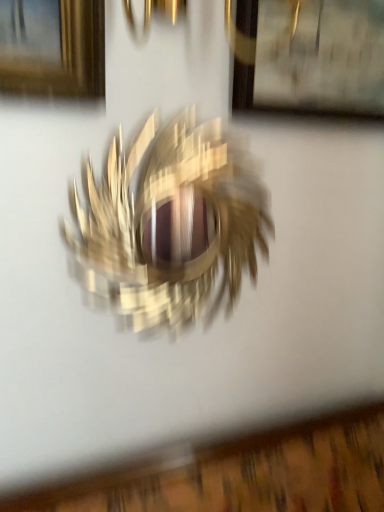
Question: Is wooden picture frame at upper center behind metallic gold bird at center?

Choices:
 (A) yes
 (B) no

Answer: (A)

Question: Does wooden picture frame at upper center have a smaller size compared to metallic gold bird at center?

Choices:
 (A) no
 (B) yes

Answer: (B)

Question: Can you confirm if wooden picture frame at upper center is positioned to the right of metallic gold bird at center?

Choices:
 (A) yes
 (B) no

Answer: (A)

Question: From a real-world perspective, is wooden picture frame at upper center physically below metallic gold bird at center?

Choices:
 (A) yes
 (B) no

Answer: (B)

Question: Can you confirm if wooden picture frame at upper center is taller than metallic gold bird at center?

Choices:
 (A) yes
 (B) no

Answer: (B)

Question: Can you confirm if wooden picture frame at upper center is wider than metallic gold bird at center?

Choices:
 (A) yes
 (B) no

Answer: (A)

Question: From a real-world perspective, is metallic gold bird at center positioned over wooden picture frame at upper center based on gravity?

Choices:
 (A) yes
 (B) no

Answer: (B)

Question: Does metallic gold bird at center lie in front of wooden picture frame at upper center?

Choices:
 (A) yes
 (B) no

Answer: (A)

Question: Considering the relative sizes of metallic gold bird at center and wooden picture frame at upper center in the image provided, is metallic gold bird at center bigger than wooden picture frame at upper center?

Choices:
 (A) yes
 (B) no

Answer: (A)

Question: Does metallic gold bird at center have a greater width compared to wooden picture frame at upper center?

Choices:
 (A) no
 (B) yes

Answer: (A)

Question: Does metallic gold bird at center turn towards wooden picture frame at upper center?

Choices:
 (A) no
 (B) yes

Answer: (A)

Question: Considering the relative positions of metallic gold bird at center and wooden picture frame at upper center in the image provided, is metallic gold bird at center to the right of wooden picture frame at upper center from the viewer's perspective?

Choices:
 (A) yes
 (B) no

Answer: (B)

Question: From a real-world perspective, is wooden picture frame at upper center positioned above or below metallic gold bird at center?

Choices:
 (A) below
 (B) above

Answer: (B)